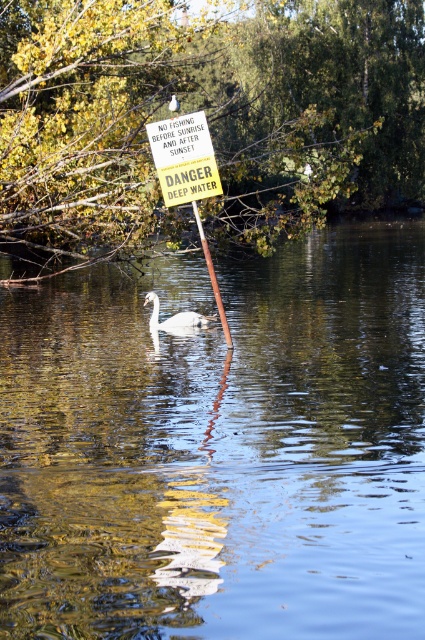
You are a hiker who has just arrived at the lakeside and notices the yellow paper sign at center and the wooden pole at center. From your vantage point, which object appears closer to you?

The yellow paper sign at center appears closer to you because the wooden pole at center is behind it.